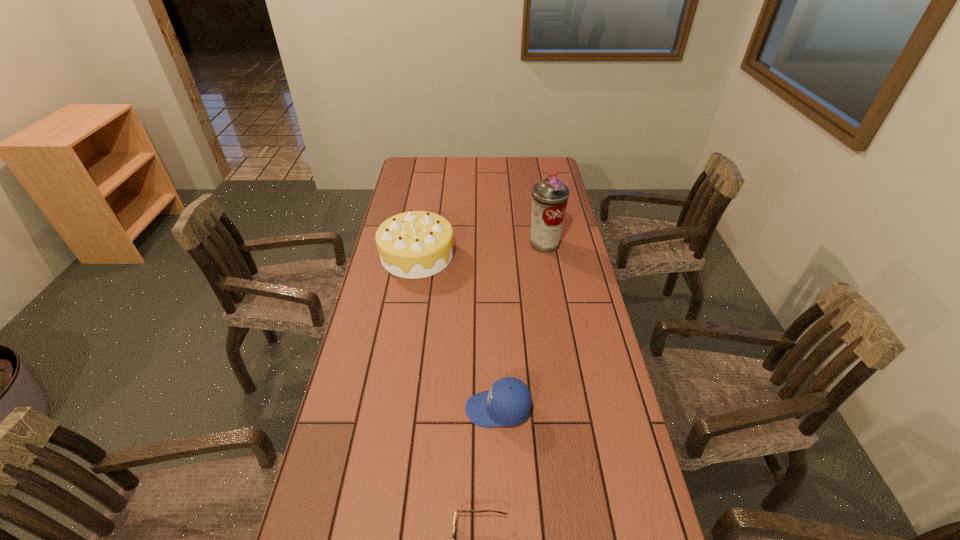
At what (x,y) coordinates should I click in order to perform the action: click on free space between the leftmost object and the tallest object. Please return your answer as a coordinate pair (x, y). The width and height of the screenshot is (960, 540). Looking at the image, I should click on (481, 249).

Locate an element on the screen. The height and width of the screenshot is (540, 960). object that ranks as the third closest to the birthday cake is located at coordinates (459, 511).

This screenshot has width=960, height=540. I want to click on object that stands as the second closest to the rightmost object, so click(508, 402).